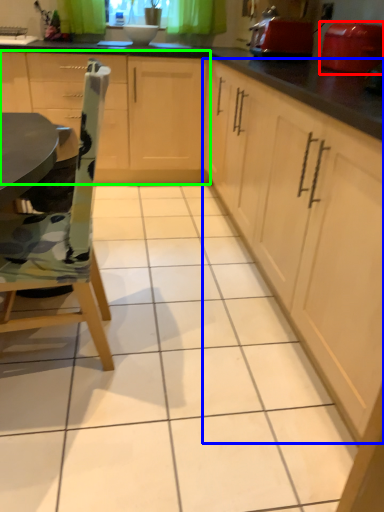
Question: Which object is the farthest from appliance (highlighted by a red box)? Choose among these: cabinetry (highlighted by a blue box) or cabinetry (highlighted by a green box).

Choices:
 (A) cabinetry
 (B) cabinetry

Answer: (B)